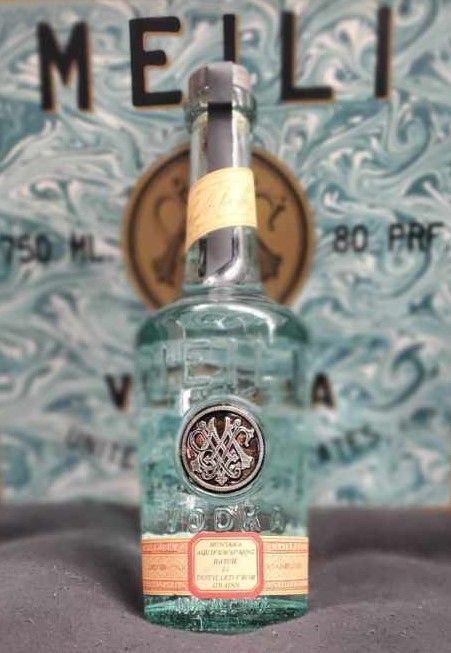
Locate an element on the screen. The height and width of the screenshot is (653, 451). bottle is located at coordinates (282, 466).